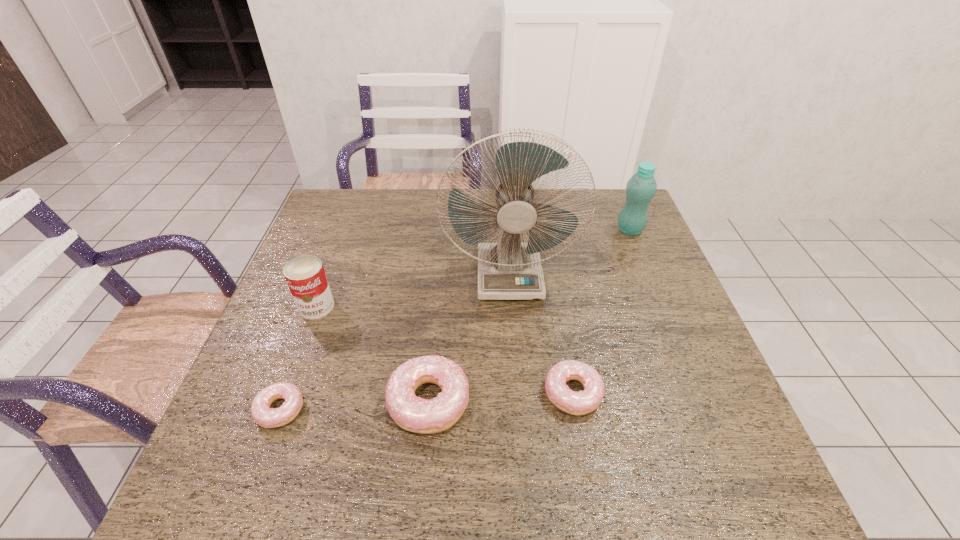
Identify the location of doughnut identified as the second closest to the fourth shortest object. (412, 413).

Identify which doughnut is the second closest to the tallest doughnut. Please provide its 2D coordinates. Your answer should be formatted as a tuple, i.e. [(x, y)], where the tuple contains the x and y coordinates of a point satisfying the conditions above.

[(266, 417)]

Locate an element on the screen. The height and width of the screenshot is (540, 960). vacant position in the image that satisfies the following two spatial constraints: 1. at the front cap of the water bottle; 2. on the front side of the rightmost doughnut is located at coordinates (696, 393).

This screenshot has height=540, width=960. I want to click on blank space that satisfies the following two spatial constraints: 1. on the front-facing side of the tallest object; 2. on the right side of the rightmost doughnut, so click(x=518, y=393).

Find the location of a particular element. The width and height of the screenshot is (960, 540). free space that satisfies the following two spatial constraints: 1. on the front label of the shortest doughnut; 2. on the right side of the can is located at coordinates pos(278,409).